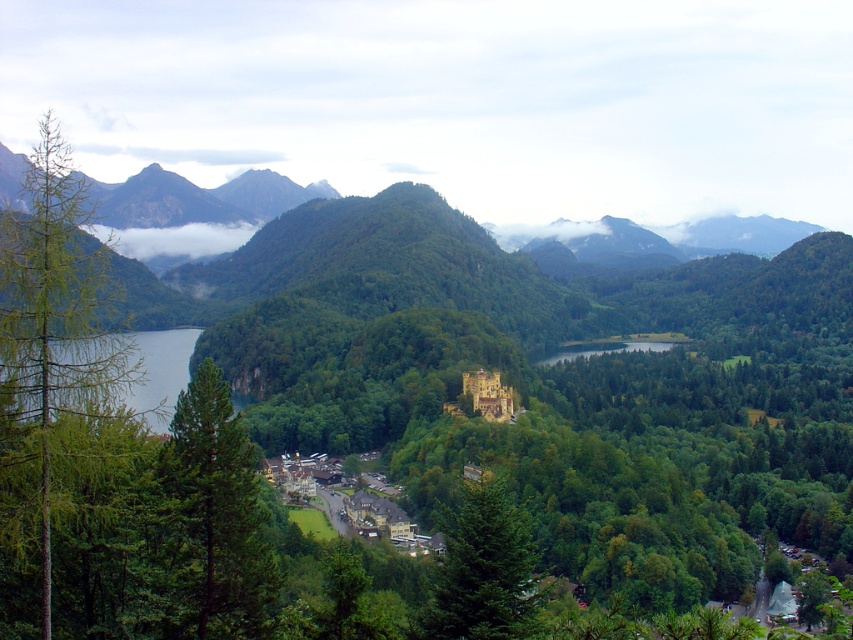
You are a hiker who wants to cross from the forest to the lake. You see the green matte tree at left and the shiny blue water at left. Which direction should you go to reach the water from the tree?

To reach the shiny blue water at left from the green matte tree at left, you should go towards the left since the shiny blue water at left is located to the left of the green matte tree at left.